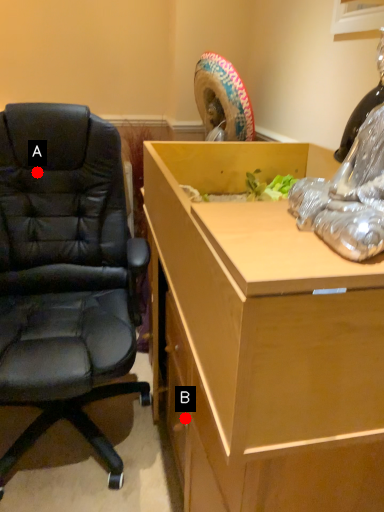
Question: Two points are circled on the image, labeled by A and B beside each circle. Among these points, which one is nearest to the camera?

Choices:
 (A) A is closer
 (B) B is closer

Answer: (B)